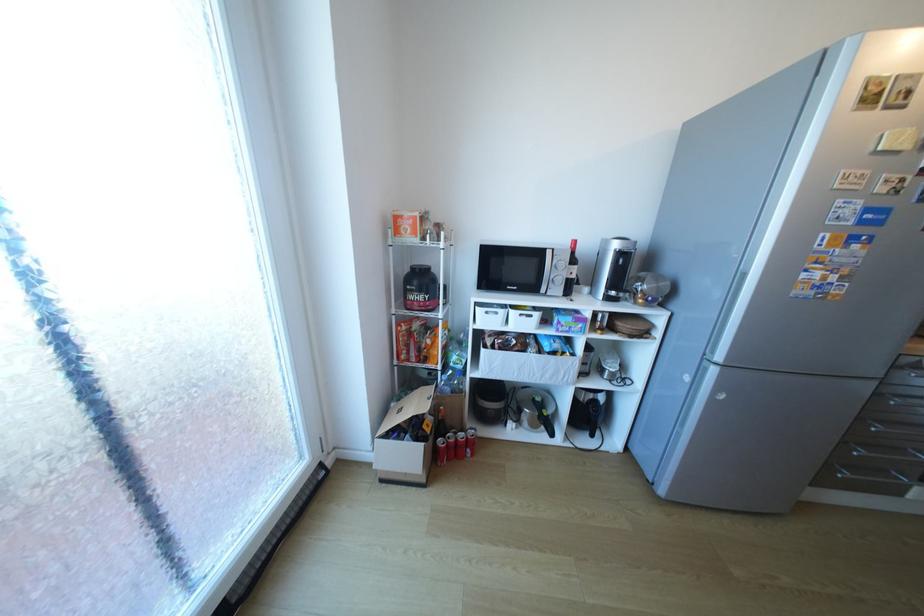
This screenshot has height=616, width=924. What do you see at coordinates (489, 400) in the screenshot?
I see `the black pot handle` at bounding box center [489, 400].